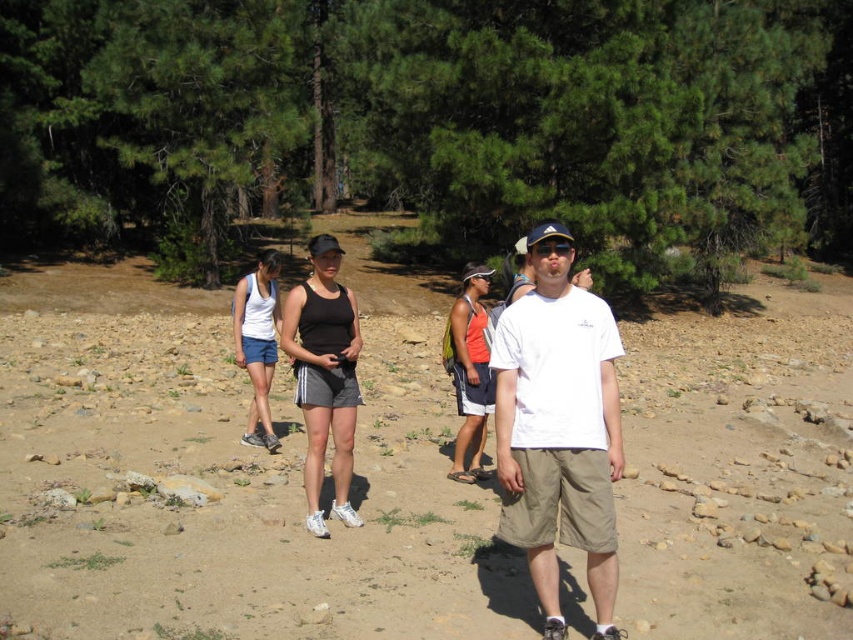
You are a photographer trying to capture a clear shot of the white fabric tank top at center. However, the green leafy pine trees at upper center are blocking your view. Can you adjust your position to avoid the obstruction?

The green leafy pine trees at upper center are positioned over the white fabric tank top at center. To avoid the obstruction, you can move your position lower to get a clear shot of the white fabric tank top at center without the trees blocking the view.

You are a photographer trying to capture a clear shot of the black fabric tank top at center. However, the green leafy pine trees at upper center are blocking your view. Can you adjust your position to avoid the obstruction?

The green leafy pine trees at upper center are above the black fabric tank top at center, so moving your camera position lower or shifting your angle downward might allow you to capture the black fabric tank top at center without the obstruction.